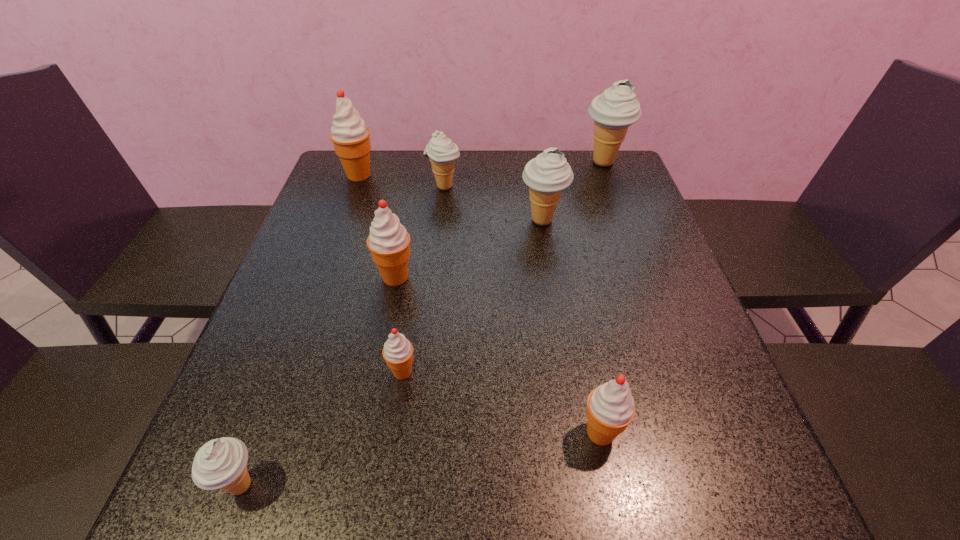
Find the location of `beige icecream that is the third nearest to the farthest red icecream`. beige icecream that is the third nearest to the farthest red icecream is located at coordinates (613, 111).

Locate an element on the screen. This screenshot has height=540, width=960. red icecream that is the third closest to the third beige icecream from right to left is located at coordinates (398, 351).

At what (x,y) coordinates should I click in order to perform the action: click on the closest red icecream to the rightmost red icecream. Please return your answer as a coordinate pair (x, y). Looking at the image, I should click on (398, 351).

This screenshot has height=540, width=960. I want to click on vacant region that satisfies the following two spatial constraints: 1. on the front side of the second beige icecream from left to right; 2. on the left side of the rightmost red icecream, so click(x=420, y=433).

The width and height of the screenshot is (960, 540). I want to click on vacant space that satisfies the following two spatial constraints: 1. on the front side of the rightmost red icecream; 2. on the right side of the third farthest red icecream, so click(394, 433).